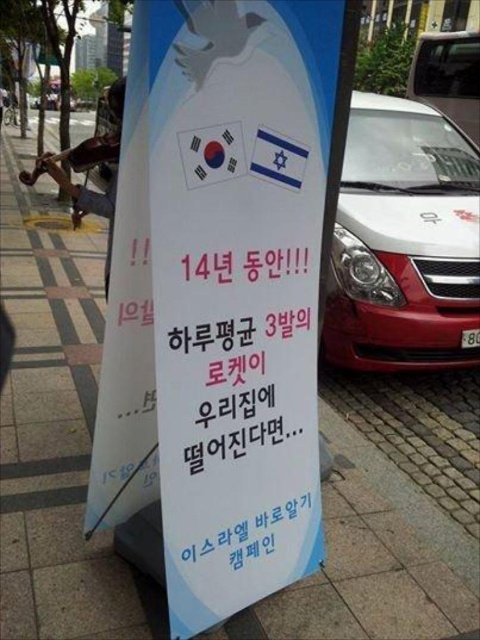
Question: Which of the following is the farthest from the observer?

Choices:
 (A) (436, 51)
 (B) (471, 225)

Answer: (A)

Question: Can you confirm if white glossy car at center is positioned to the right of metallic silver car at center?

Choices:
 (A) no
 (B) yes

Answer: (A)

Question: Which point is farther from the camera taking this photo?

Choices:
 (A) (431, 74)
 (B) (432, 179)

Answer: (A)

Question: Observing the image, what is the correct spatial positioning of white glossy car at center in reference to metallic silver car at center?

Choices:
 (A) left
 (B) right

Answer: (A)

Question: Which point appears closest to the camera in this image?

Choices:
 (A) click(408, 200)
 (B) click(468, 49)

Answer: (A)

Question: Is the position of white glossy car at center less distant than that of metallic silver car at center?

Choices:
 (A) yes
 (B) no

Answer: (A)